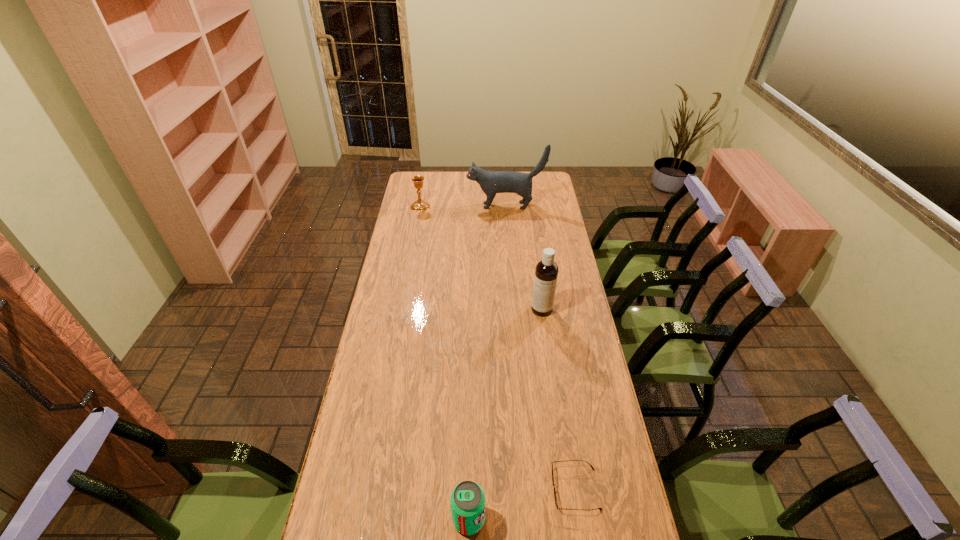
Identify the location of unoccupied position between the fourth shortest object and the pop soda. Image resolution: width=960 pixels, height=540 pixels. (505, 414).

Locate an element on the screen. The width and height of the screenshot is (960, 540). vacant space in between the cat and the pop soda is located at coordinates (488, 362).

This screenshot has width=960, height=540. In order to click on vacant area that lies between the shortest object and the second tallest object in this screenshot , I will do `click(559, 399)`.

Choose which object is the second nearest neighbor to the chalice. Please provide its 2D coordinates. Your answer should be formatted as a tuple, i.e. [(x, y)], where the tuple contains the x and y coordinates of a point satisfying the conditions above.

[(546, 272)]

Choose which object is the second nearest neighbor to the cat. Please provide its 2D coordinates. Your answer should be formatted as a tuple, i.e. [(x, y)], where the tuple contains the x and y coordinates of a point satisfying the conditions above.

[(546, 272)]

Identify the location of free space that satisfies the following two spatial constraints: 1. on the label side of the fourth shortest object; 2. on the front-facing side of the pop soda. pos(572,519).